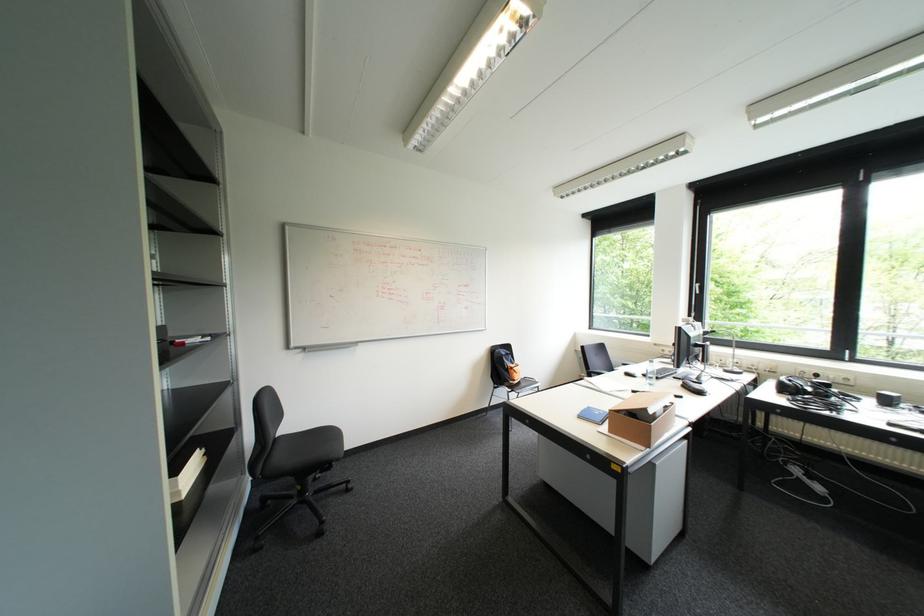
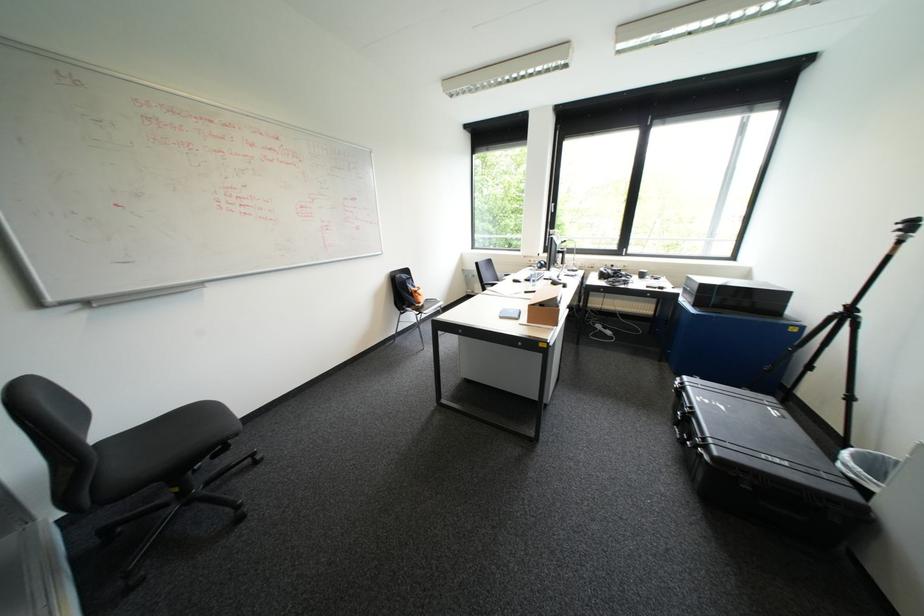
In the second image, find the point that corresponds to pixel 515 363 in the first image.

(419, 288)